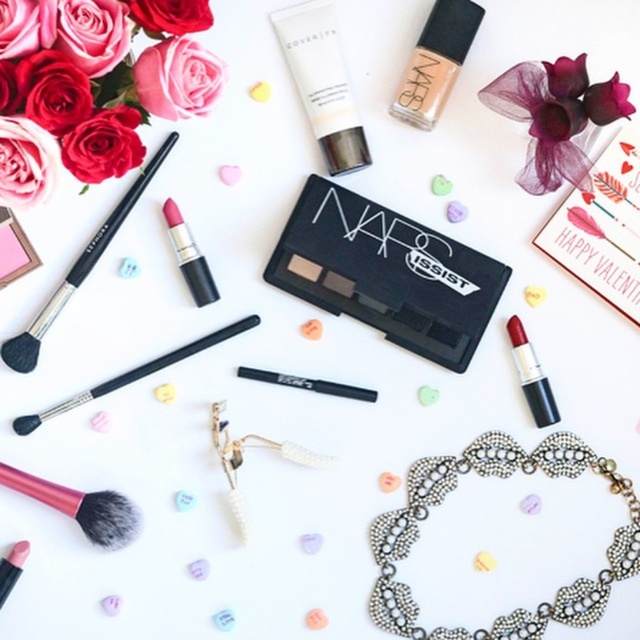
Does matte black brush at upper left appear over pink synthetic hair brush at lower left?

Yes.

Which is more to the left, matte black brush at upper left or pink synthetic hair brush at lower left?

pink synthetic hair brush at lower left

This screenshot has height=640, width=640. Find the location of `matte black brush at upper left`. matte black brush at upper left is located at coordinates (77, 269).

Does matte black brush at upper left have a lesser height compared to matte black lipstick at center?

Incorrect, matte black brush at upper left's height does not fall short of matte black lipstick at center's.

Does point (132, 182) come in front of point (545, 400)?

Yes, point (132, 182) is closer to viewer.

Between point (65, 294) and point (536, 390), which one is positioned behind?

Positioned behind is point (536, 390).

Where is `matte black brush at upper left`? Image resolution: width=640 pixels, height=640 pixels. matte black brush at upper left is located at coordinates (77, 269).

What do you see at coordinates (77, 269) in the screenshot? I see `matte black brush at upper left` at bounding box center [77, 269].

Is matte black brush at upper left above matte pink lipstick at center?

Yes, matte black brush at upper left is above matte pink lipstick at center.

Does point (28, 364) lie in front of point (192, 269)?

Yes, point (28, 364) is in front of point (192, 269).

Image resolution: width=640 pixels, height=640 pixels. I want to click on matte black brush at upper left, so click(x=77, y=269).